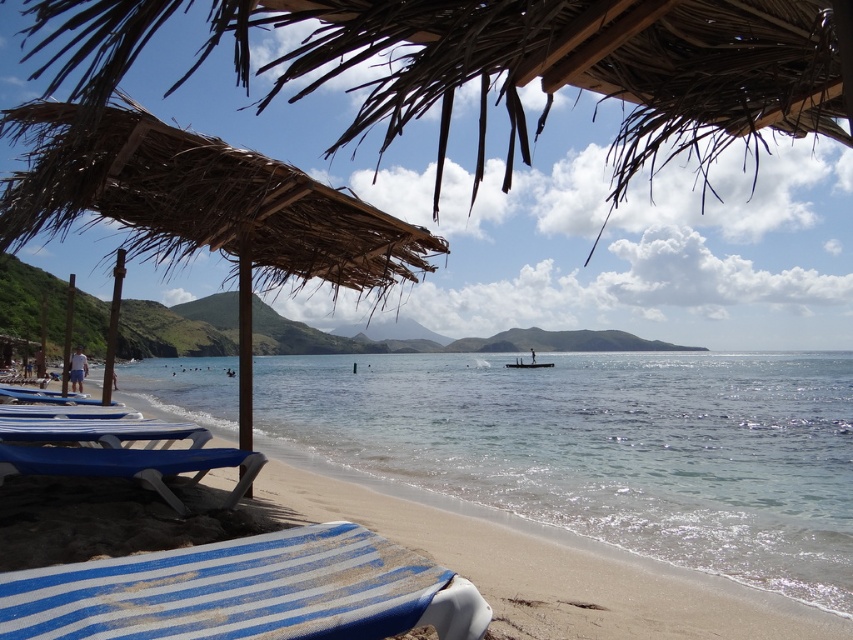
Which is more to the right, brown thatched umbrella at upper center or blue striped lounge chair at lower left?

blue striped lounge chair at lower left is more to the right.

Does brown thatched umbrella at upper center lie in front of blue striped lounge chair at lower left?

That is True.

Between point (763, 12) and point (24, 417), which one is positioned behind?

The point (24, 417) is behind.

The image size is (853, 640). Find the location of `brown thatched umbrella at upper center`. brown thatched umbrella at upper center is located at coordinates (572, 67).

Which is in front, point (729, 440) or point (543, 365)?

Point (729, 440) is in front.

Which is above, clear blue water at center or wooden canoe at center?

wooden canoe at center is higher up.

Who is more distant from viewer, (801, 483) or (532, 362)?

The point (532, 362) is behind.

I want to click on clear blue water at center, so click(601, 449).

Does thatched straw umbrella at upper left appear on the left side of wooden canoe at center?

Correct, you'll find thatched straw umbrella at upper left to the left of wooden canoe at center.

Between thatched straw umbrella at upper left and wooden canoe at center, which one appears on the left side from the viewer's perspective?

From the viewer's perspective, thatched straw umbrella at upper left appears more on the left side.

Locate an element on the screen. This screenshot has height=640, width=853. thatched straw umbrella at upper left is located at coordinates (201, 205).